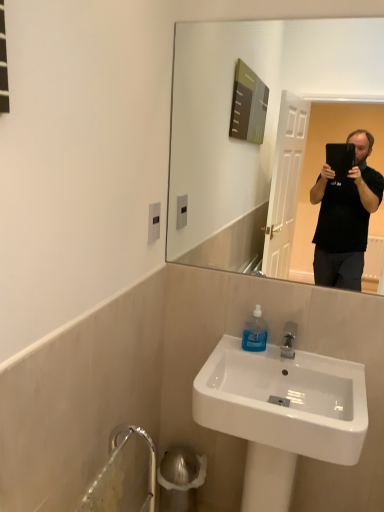
Question: From a real-world perspective, is white glossy sink at lower center above or below transparent plastic bottle at sink?

Choices:
 (A) above
 (B) below

Answer: (B)

Question: Looking at the image, does white glossy sink at lower center seem bigger or smaller compared to transparent plastic bottle at sink?

Choices:
 (A) small
 (B) big

Answer: (B)

Question: Which is correct: white glossy sink at lower center is inside transparent plastic bottle at sink, or outside of it?

Choices:
 (A) outside
 (B) inside

Answer: (A)

Question: Does point [251, 348] appear closer or farther from the camera than point [215, 417]?

Choices:
 (A) closer
 (B) farther

Answer: (B)

Question: From their relative heights in the image, would you say transparent plastic bottle at sink is taller or shorter than white glossy sink at lower center?

Choices:
 (A) tall
 (B) short

Answer: (B)

Question: Is transparent plastic bottle at sink inside the boundaries of white glossy sink at lower center, or outside?

Choices:
 (A) outside
 (B) inside

Answer: (B)

Question: From the image's perspective, relative to white glossy sink at lower center, is transparent plastic bottle at sink above or below?

Choices:
 (A) above
 (B) below

Answer: (A)